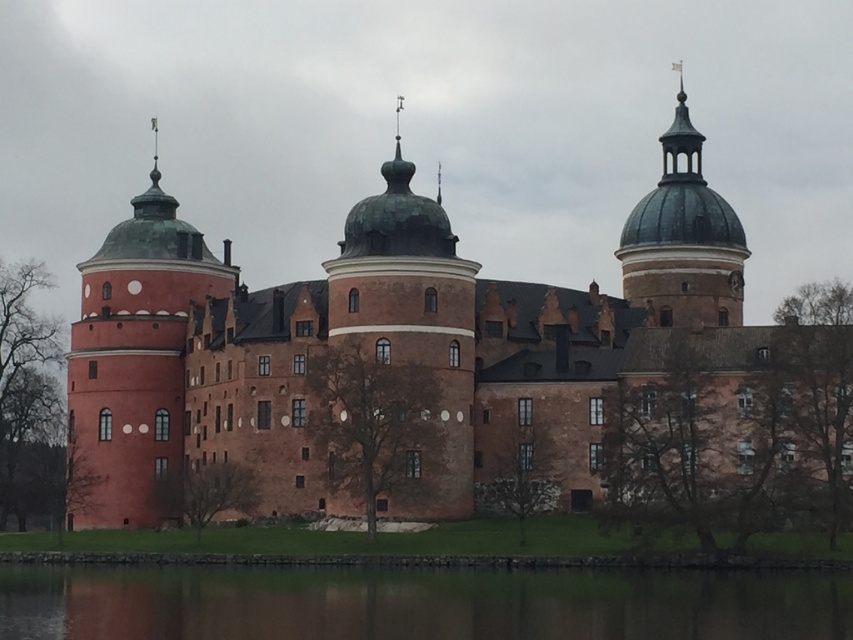
You are a tour guide explaining the castle layout to visitors. Pointing to the rustic brick castle at center and the green copper dome at upper right, you want to clarify their spatial relationship. Which object is located above the other?

The green copper dome at upper right is positioned above the rustic brick castle at center.

You are standing in front of the castle and want to take a photo that includes both the rustic brick castle at center and the green reflective water at lower center. Based on their positions, which object should you position on the right side of your photo frame?

The green reflective water at lower center should be positioned on the right side of the photo frame because the rustic brick castle at center is to the left of it.

You are a tourist standing at the edge of the green reflective water at lower center, looking towards the rustic brick castle at center. Which direction should you walk to get closer to the castle?

Since the rustic brick castle at center is positioned over the green reflective water at lower center, you should walk forward towards the castle as it is directly ahead of you.